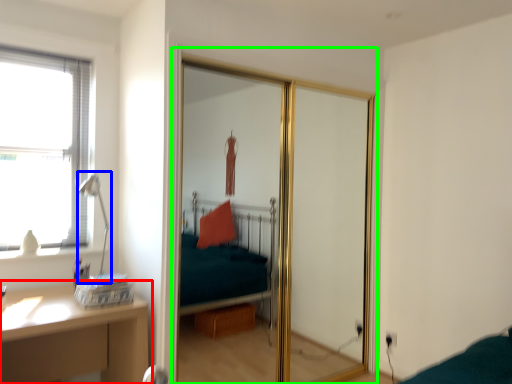
Question: Considering the real-world distances, which object is closest to table (highlighted by a red box)? table lamp (highlighted by a blue box) or screen door (highlighted by a green box).

Choices:
 (A) table lamp
 (B) screen door

Answer: (A)